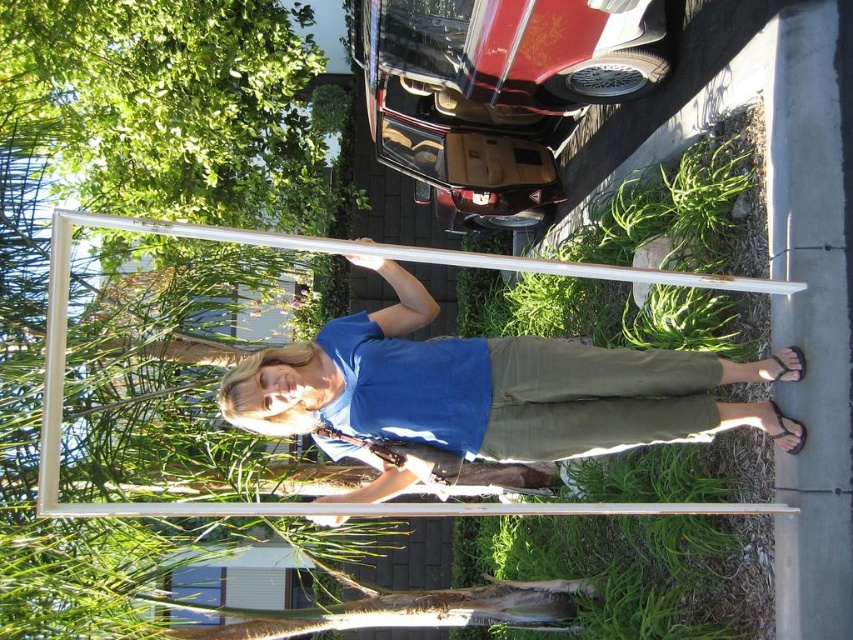
Between point (596, 413) and point (639, 282), which one is positioned behind?

The point (639, 282) is behind.

Is matte white surfboard at center above white matte pole at center?

No.

Is point (479, 445) farther from camera compared to point (553, 273)?

Yes, it is.

Where is `matte white surfboard at center`? matte white surfboard at center is located at coordinates (494, 387).